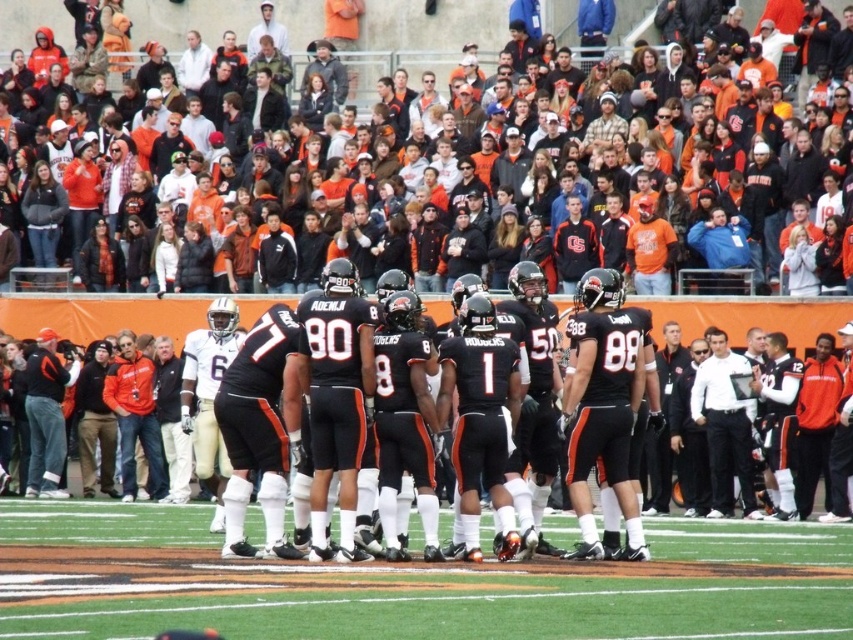
Question: Does green turf at center appear over orange jersey fans at upper center?

Choices:
 (A) yes
 (B) no

Answer: (B)

Question: Is green turf at center to the left of black matte football team at center from the viewer's perspective?

Choices:
 (A) yes
 (B) no

Answer: (B)

Question: Which object is positioned farthest from the black matte football team at center?

Choices:
 (A) orange jersey fans at upper center
 (B) green turf at center

Answer: (A)

Question: Which point is closer to the camera?

Choices:
 (A) green turf at center
 (B) orange jersey fans at upper center

Answer: (A)

Question: Which point is closer to the camera?

Choices:
 (A) black matte football team at center
 (B) orange jersey fans at upper center
 (C) green turf at center

Answer: (C)

Question: Can you confirm if green turf at center is thinner than orange jersey fans at upper center?

Choices:
 (A) no
 (B) yes

Answer: (B)